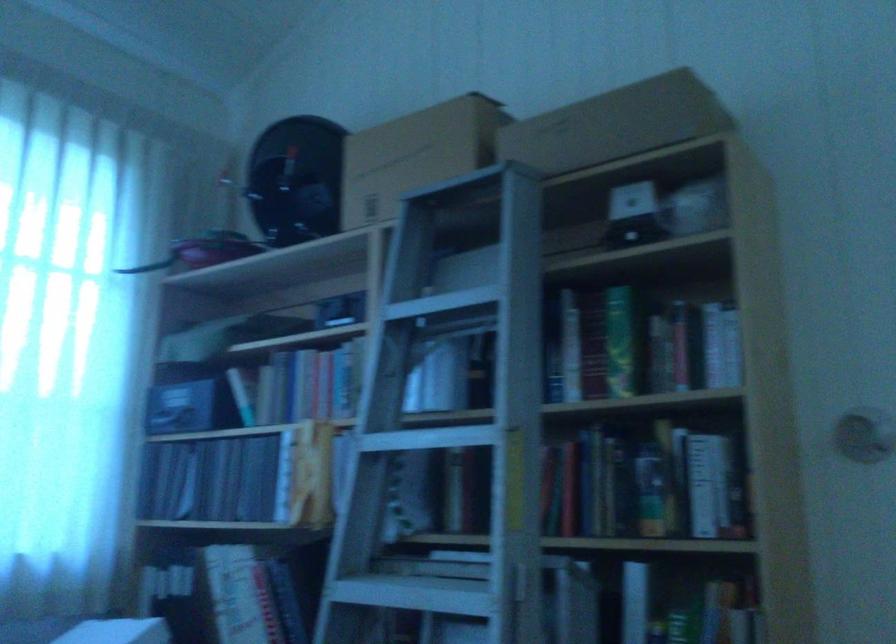
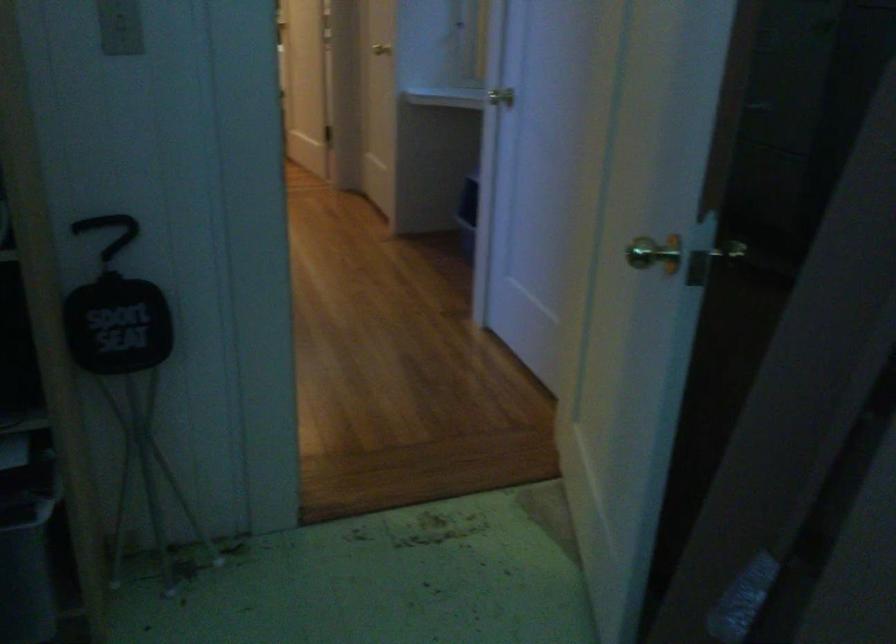
Based on the photo, the first image is from the beginning of the video and the second image is from the end. How did the camera likely rotate when shooting the video?

The camera's rotation is toward right-down.